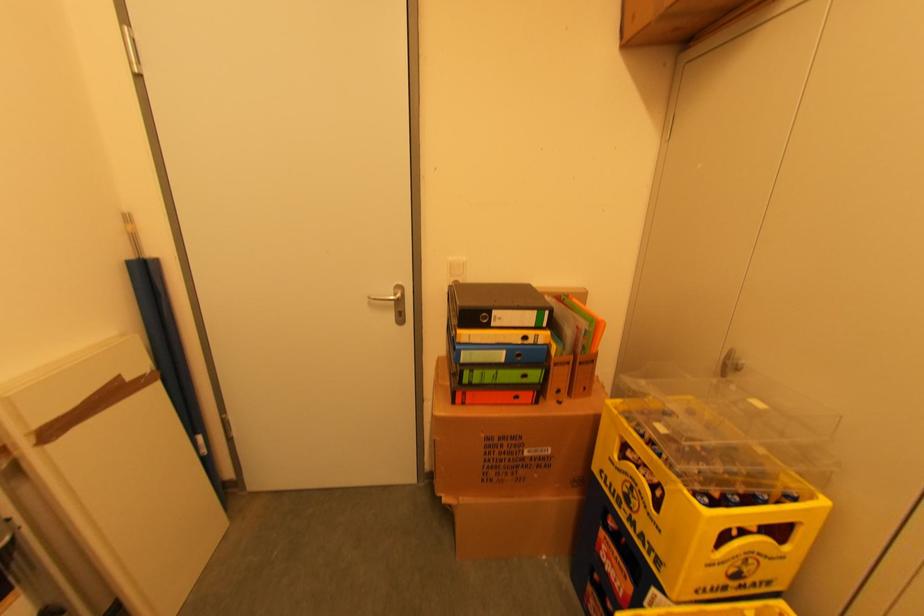
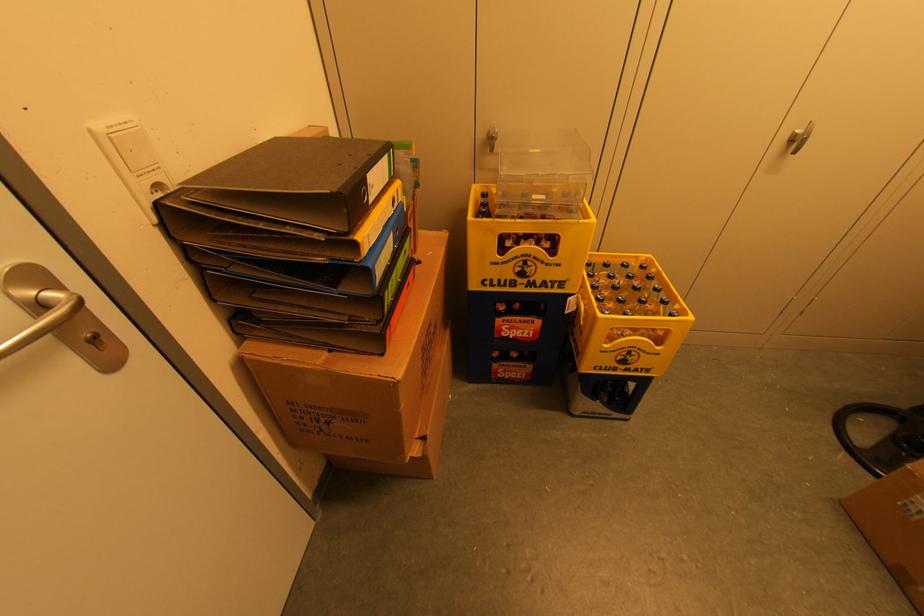
Locate, in the second image, the point that corresponds to pixel 604 533 in the first image.

(501, 322)